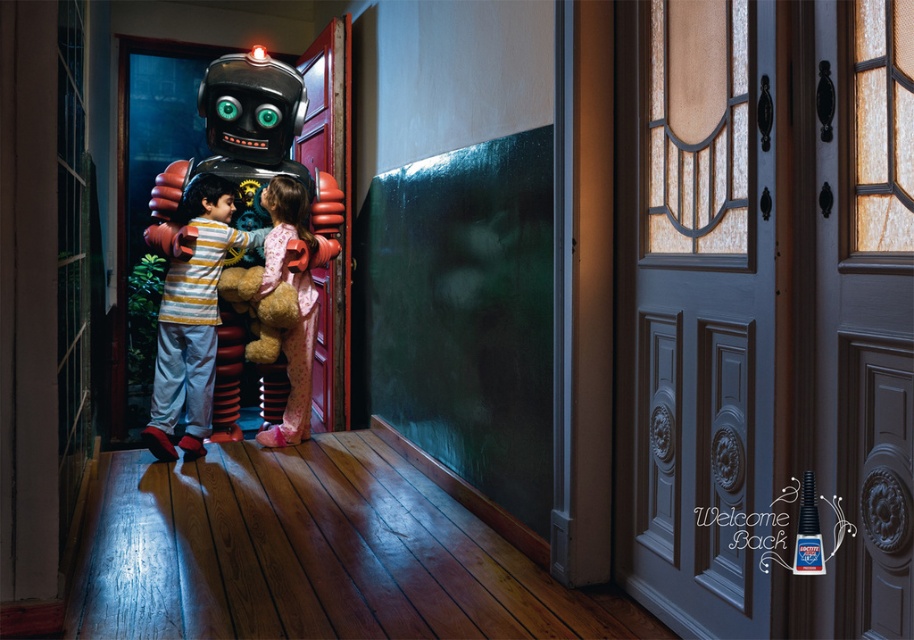
You are trying to fit both the shiny metallic robot at center and the soft plush teddy bear at center through a narrow doorway. Based on their sizes, which one might have a harder time passing through?

The shiny metallic robot at center might be wider than the soft plush teddy bear at center, so it might have a harder time passing through the narrow doorway.

You are standing in the hallway and want to reach the point marked at coordinates [330,237]. If you are currently 10 feet away from that point, how many more feet do you need to walk to reach it?

The distance of point [330,237] from viewer is 13.80 feet. Since you are currently 10 feet away, you need to walk an additional 3.8 feet to reach it.